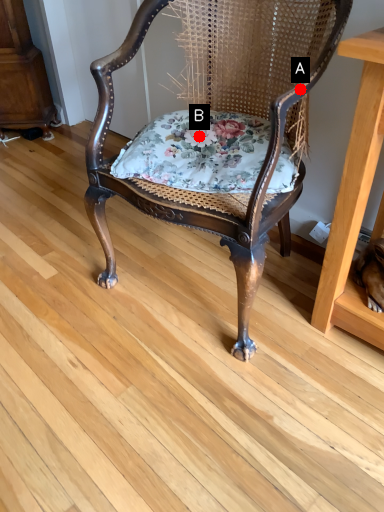
Question: Two points are circled on the image, labeled by A and B beside each circle. Among these points, which one is farthest from the camera?

Choices:
 (A) A is further
 (B) B is further

Answer: (B)